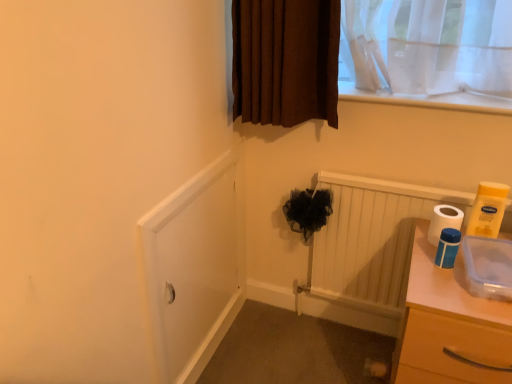
Question: Is blue plastic toilet paper at right, marked as the first toilet paper in a left-to-right arrangement, situated inside white matte toilet paper at right, which ranks as the second toilet paper in right-to-left order, or outside?

Choices:
 (A) inside
 (B) outside

Answer: (B)

Question: Would you say blue plastic toilet paper at right, which is the third toilet paper from right to left, is to the left or to the right of white matte toilet paper at right, placed as the second toilet paper when sorted from left to right, in the picture?

Choices:
 (A) right
 (B) left

Answer: (B)

Question: Considering the real-world distances, which object is closest to the white matte screen door at lower left?

Choices:
 (A) white matte toilet paper at right, placed as the second toilet paper when sorted from left to right
 (B) clear plastic chest of drawers at right
 (C) white glossy toilet paper at right, the first toilet paper when ordered from right to left
 (D) blue plastic toilet paper at right, marked as the first toilet paper in a left-to-right arrangement
 (E) white wooden radiator at lower center

Answer: (E)

Question: Which of these objects is positioned farthest from the white matte toilet paper at right, which ranks as the second toilet paper in right-to-left order?

Choices:
 (A) white matte screen door at lower left
 (B) white wooden radiator at lower center
 (C) white glossy toilet paper at right, the first toilet paper when ordered from right to left
 (D) clear plastic chest of drawers at right
 (E) blue plastic toilet paper at right, marked as the first toilet paper in a left-to-right arrangement

Answer: (A)